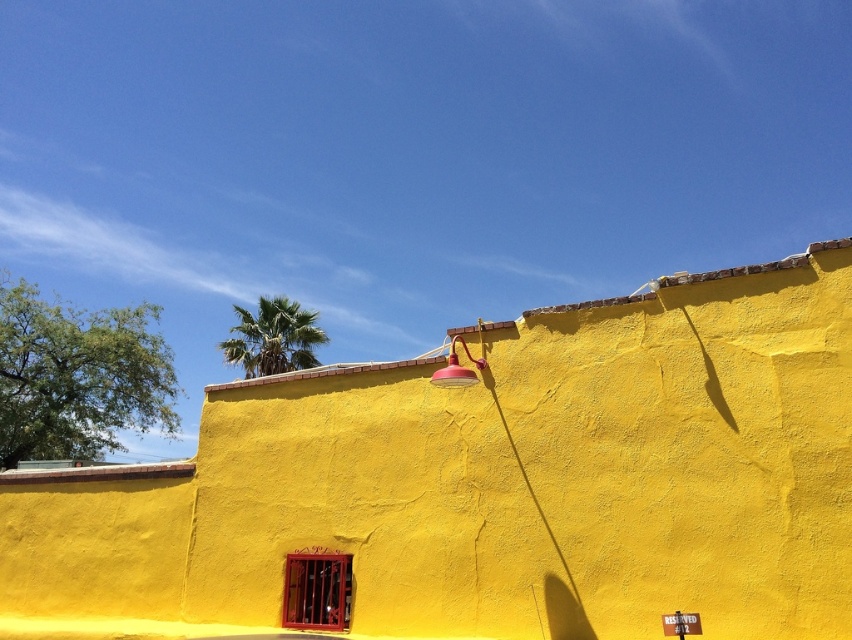
Does green leafy palm tree at upper center lie in front of matte red lamp at upper center?

No, it is behind matte red lamp at upper center.

Who is taller, green leafy palm tree at upper center or matte red lamp at upper center?

With more height is green leafy palm tree at upper center.

Is point (252, 349) positioned behind point (452, 384)?

That is True.

Find the location of `green leafy palm tree at upper center`. green leafy palm tree at upper center is located at coordinates (272, 337).